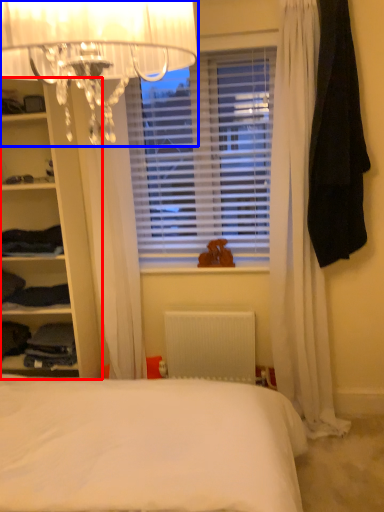
Question: Which object is closer to the camera taking this photo, shelf (highlighted by a red box) or lamp (highlighted by a blue box)?

Choices:
 (A) shelf
 (B) lamp

Answer: (B)